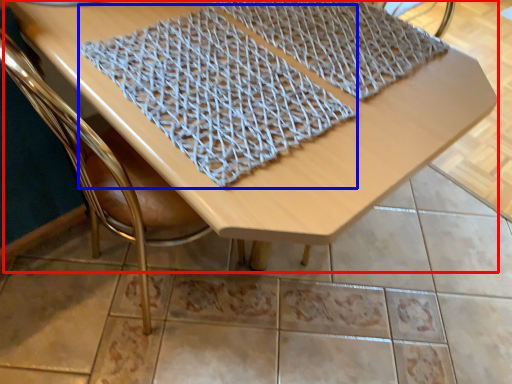
Question: Among these objects, which one is nearest to the camera, table (highlighted by a red box) or blanket (highlighted by a blue box)?

Choices:
 (A) table
 (B) blanket

Answer: (A)